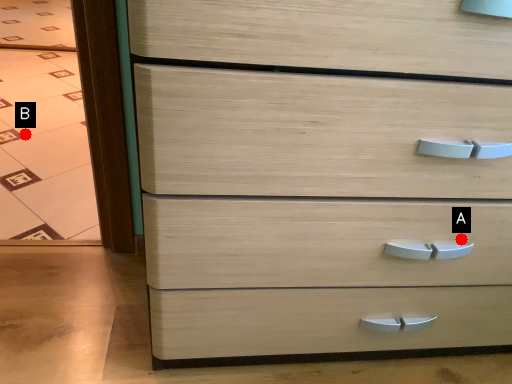
Question: Two points are circled on the image, labeled by A and B beside each circle. Which of the following is the farthest from the observer?

Choices:
 (A) A is further
 (B) B is further

Answer: (B)